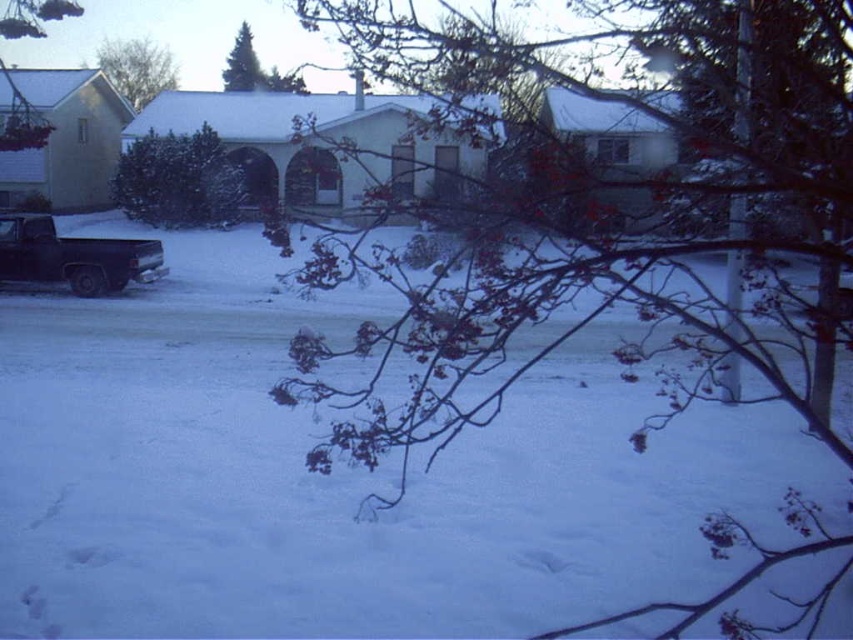
Is point (614, 24) less distant than point (120, 291)?

Yes, point (614, 24) is in front of point (120, 291).

This screenshot has width=853, height=640. Find the location of `bare branches at center`. bare branches at center is located at coordinates (589, 220).

Identify the location of bare branches at center. This screenshot has height=640, width=853. (589, 220).

Is smooth bark tree at upper left wider than bare branches at upper left?

Yes, smooth bark tree at upper left is wider than bare branches at upper left.

This screenshot has height=640, width=853. Identify the location of smooth bark tree at upper left. (33, 17).

Identify the location of smooth bark tree at upper left. The image size is (853, 640). (33, 17).

Does bare branches at upper left have a larger size compared to green matte evergreen tree at upper center?

No.

Identify the location of bare branches at upper left. (137, 68).

Who is more distant from viewer, (x=160, y=74) or (x=242, y=44)?

The point (x=160, y=74) is more distant.

At what (x,y) coordinates should I click in order to perform the action: click on bare branches at upper left. Please return your answer as a coordinate pair (x, y). Image resolution: width=853 pixels, height=640 pixels. Looking at the image, I should click on (137, 68).